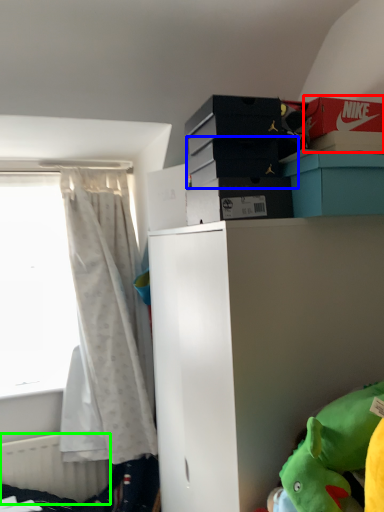
Question: Estimate the real-world distances between objects in this image. Which object is farther from storage box (highlighted by a red box), storage box (highlighted by a blue box) or radiator (highlighted by a green box)?

Choices:
 (A) storage box
 (B) radiator

Answer: (B)